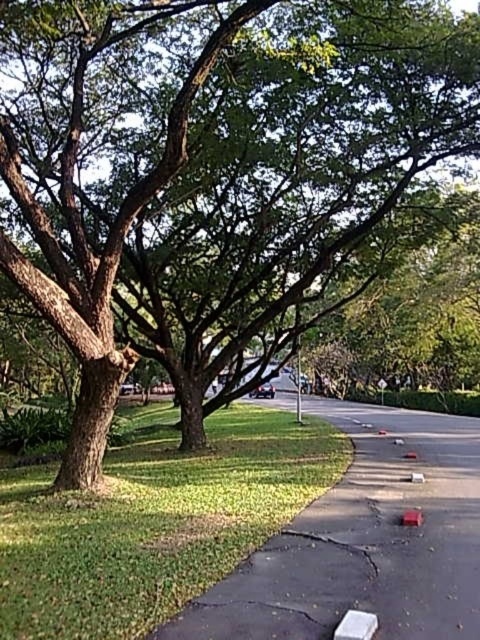
Is green grass at lower left smaller than smooth asphalt sidewalk at lower center?

Indeed, green grass at lower left has a smaller size compared to smooth asphalt sidewalk at lower center.

Is point (155, 493) in front of point (469, 520)?

No, it is not.

In order to click on green grass at lower left in this screenshot , I will do click(154, 522).